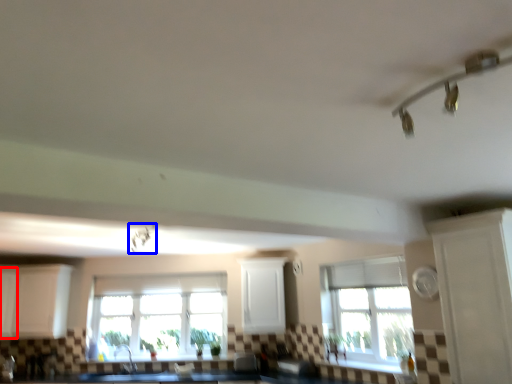
Question: Which object appears closest to the camera in this image, cabinetry (highlighted by a red box) or light fixture (highlighted by a blue box)?

Choices:
 (A) cabinetry
 (B) light fixture

Answer: (B)